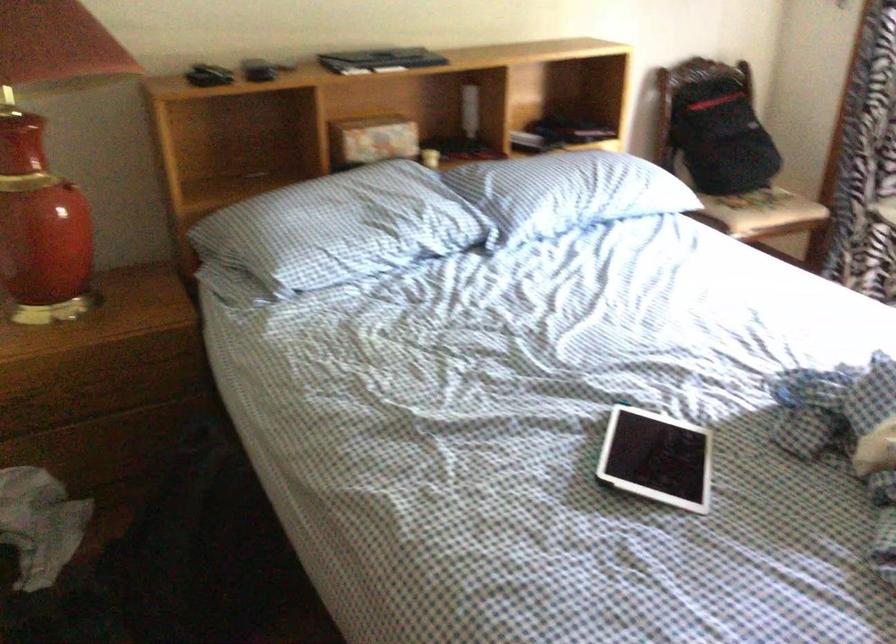
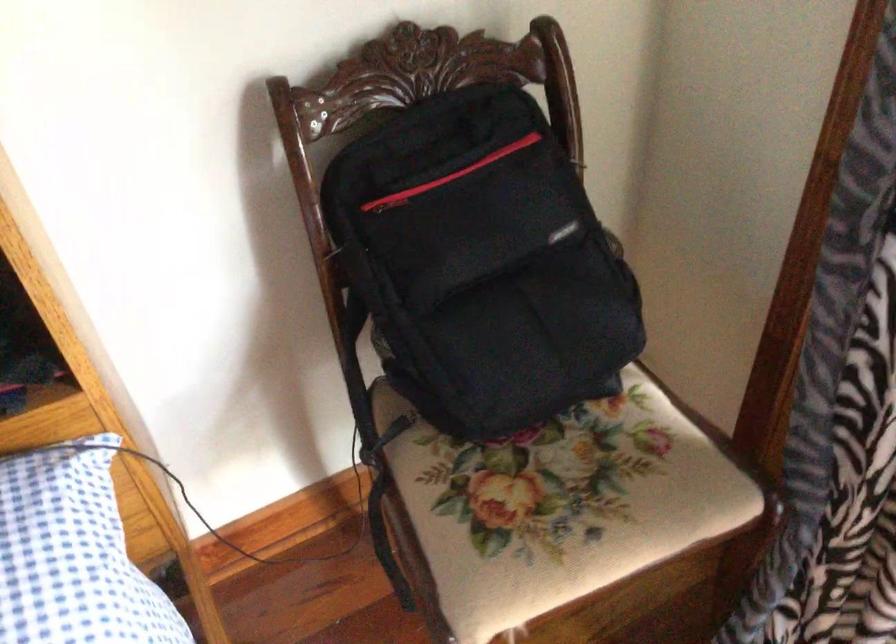
Locate, in the second image, the point that corresponds to point (771, 190) in the first image.

(556, 506)